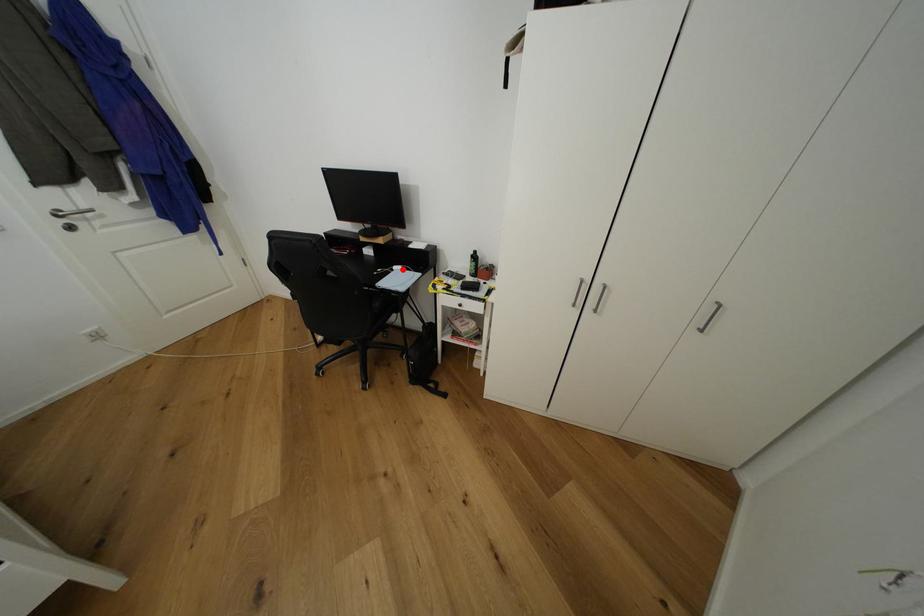
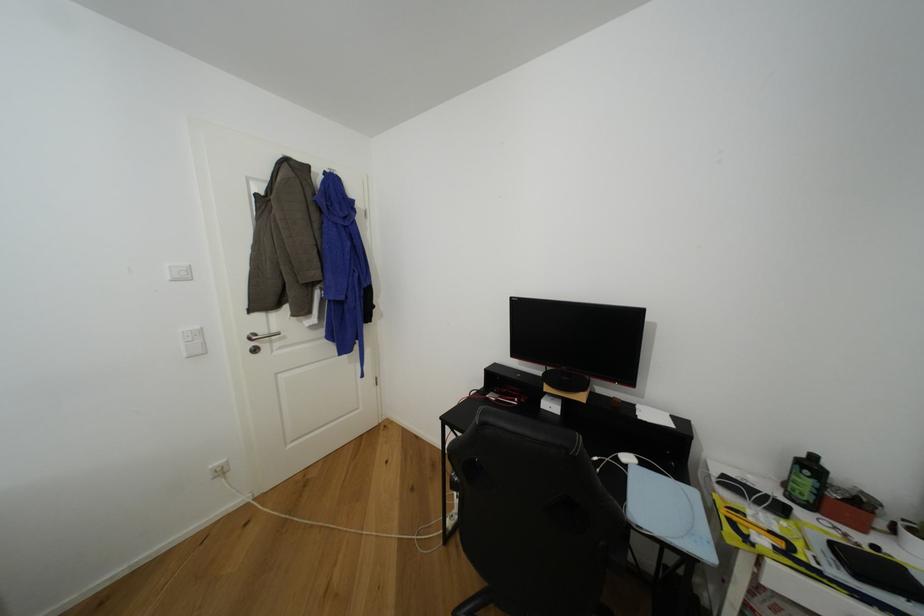
Find the pixel in the second image that matches the highlighted location in the first image.

(633, 460)